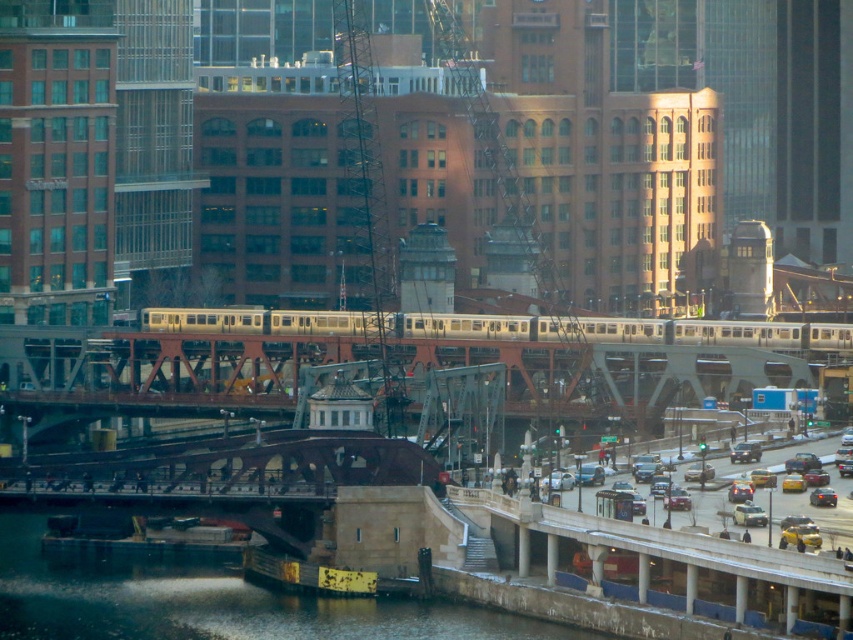
Question: Is steel bridge at center further to the viewer compared to dark gray concrete river at lower left?

Choices:
 (A) yes
 (B) no

Answer: (A)

Question: Is steel bridge at center smaller than dark gray concrete river at lower left?

Choices:
 (A) yes
 (B) no

Answer: (B)

Question: Where is dark gray concrete river at lower left located in relation to silver metallic train at center in the image?

Choices:
 (A) right
 (B) left

Answer: (B)

Question: Estimate the real-world distances between objects in this image. Which object is closer to the steel bridge at center?

Choices:
 (A) silver metallic train at center
 (B) yellow metallic taxi at lower right
 (C) dark gray concrete river at lower left

Answer: (A)

Question: Which point is closer to the camera taking this photo?

Choices:
 (A) (291, 316)
 (B) (699, 513)
 (C) (3, 572)

Answer: (B)

Question: Which of the following is the farthest from the observer?

Choices:
 (A) yellow metallic taxi at lower right
 (B) silver metallic train at center
 (C) dark gray concrete river at lower left
 (D) steel bridge at center

Answer: (B)